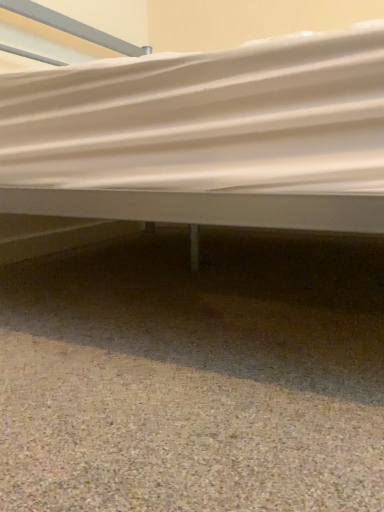
Question: Is brown gravel at lower center shorter than white fabric bed at center?

Choices:
 (A) no
 (B) yes

Answer: (B)

Question: Is brown gravel at lower center bigger than white fabric bed at center?

Choices:
 (A) no
 (B) yes

Answer: (A)

Question: Is the position of brown gravel at lower center more distant than that of white fabric bed at center?

Choices:
 (A) yes
 (B) no

Answer: (B)

Question: Could you tell me if brown gravel at lower center is turned towards white fabric bed at center?

Choices:
 (A) yes
 (B) no

Answer: (B)

Question: Is brown gravel at lower center far from white fabric bed at center?

Choices:
 (A) yes
 (B) no

Answer: (B)

Question: Is brown gravel at lower center oriented away from white fabric bed at center?

Choices:
 (A) yes
 (B) no

Answer: (B)

Question: Is brown gravel at lower center located within white fabric bed at center?

Choices:
 (A) no
 (B) yes

Answer: (A)

Question: Considering the relative positions of white fabric bed at center and brown gravel at lower center in the image provided, is white fabric bed at center behind brown gravel at lower center?

Choices:
 (A) yes
 (B) no

Answer: (A)

Question: From a real-world perspective, is white fabric bed at center physically above brown gravel at lower center?

Choices:
 (A) yes
 (B) no

Answer: (A)

Question: Can you see white fabric bed at center touching brown gravel at lower center?

Choices:
 (A) yes
 (B) no

Answer: (B)

Question: Can you confirm if white fabric bed at center is wider than brown gravel at lower center?

Choices:
 (A) yes
 (B) no

Answer: (A)

Question: Can you confirm if white fabric bed at center is positioned to the right of brown gravel at lower center?

Choices:
 (A) yes
 (B) no

Answer: (A)

Question: From the image's perspective, is brown gravel at lower center positioned above or below white fabric bed at center?

Choices:
 (A) above
 (B) below

Answer: (B)